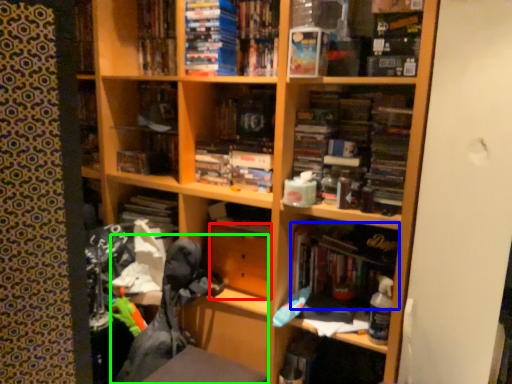
Question: Estimate the real-world distances between objects in this image. Which object is closer to drawer (highlighted by a red box), book (highlighted by a blue box) or swivel chair (highlighted by a green box)?

Choices:
 (A) book
 (B) swivel chair

Answer: (B)